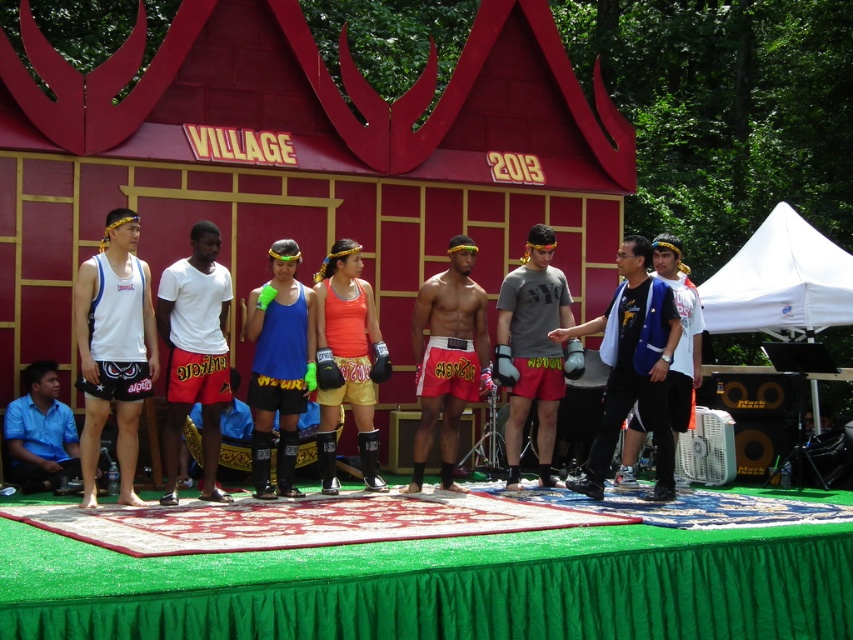
Question: Is green artificial turf at center bigger than blue fabric shirt at center?

Choices:
 (A) yes
 (B) no

Answer: (A)

Question: Which is farther from the blue fabric shirt at lower left?

Choices:
 (A) blue fabric vest at right
 (B) gray cotton shirt at center

Answer: (A)

Question: Is blue fabric shorts at center further to camera compared to orange fabric shorts at center?

Choices:
 (A) no
 (B) yes

Answer: (A)

Question: Can you confirm if white fabric canopy at right is thinner than blue fabric vest at right?

Choices:
 (A) no
 (B) yes

Answer: (A)

Question: Which point appears closest to the camera in this image?

Choices:
 (A) (387, 364)
 (B) (137, 269)
 (C) (33, 460)

Answer: (B)

Question: Which object is positioned closest to the gray cotton shirt at center?

Choices:
 (A) blue fabric vest at right
 (B) green artificial turf at center
 (C) blue fabric shirt at lower left

Answer: (A)